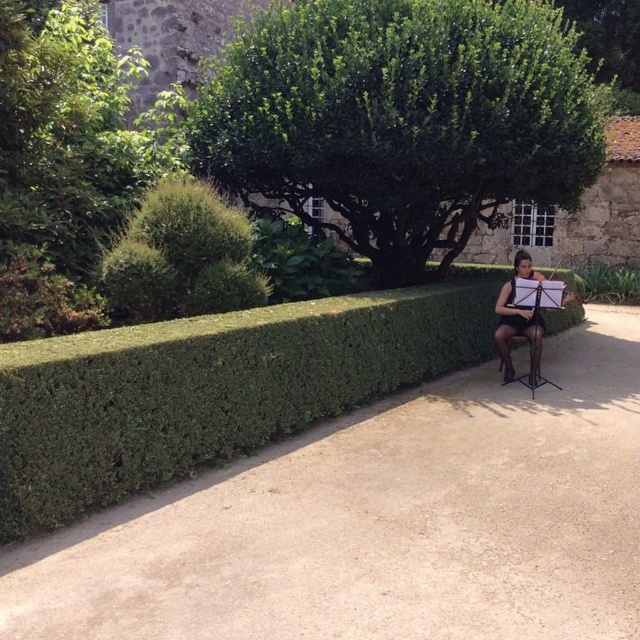
Can you confirm if green leafy tree at center is taller than black sheer dress at right?

No, green leafy tree at center is not taller than black sheer dress at right.

Does green leafy tree at center have a lesser width compared to black sheer dress at right?

In fact, green leafy tree at center might be wider than black sheer dress at right.

Which is in front, point (280, 188) or point (528, 269)?

Point (528, 269)

You are a GUI agent. You are given a task and a screenshot of the screen. Output one action in this format:
    pyautogui.click(x=<x>, y=<y>)
    Task: Click on the green leafy tree at center
    Image resolution: width=640 pixels, height=640 pixels.
    Given the screenshot: What is the action you would take?
    [x=401, y=118]

Which is above, dirt path at center or green leafy tree at center?

green leafy tree at center is above.

Who is taller, dirt path at center or green leafy tree at center?

green leafy tree at center

Which is in front, point (481, 556) or point (216, 138)?

Point (481, 556) is more forward.

Identify the location of dirt path at center. The width and height of the screenshot is (640, 640). (380, 522).

Which of these two, dirt path at center or black sheer dress at right, stands shorter?

Standing shorter between the two is dirt path at center.

You are a GUI agent. You are given a task and a screenshot of the screen. Output one action in this format:
    pyautogui.click(x=<x>, y=<y>)
    Task: Click on the dirt path at center
    This screenshot has width=640, height=640.
    Given the screenshot: What is the action you would take?
    pyautogui.click(x=380, y=522)

Measure the distance between dirt path at center and camera.

dirt path at center is 5.01 meters from camera.

Image resolution: width=640 pixels, height=640 pixels. Identify the location of dirt path at center. (380, 522).